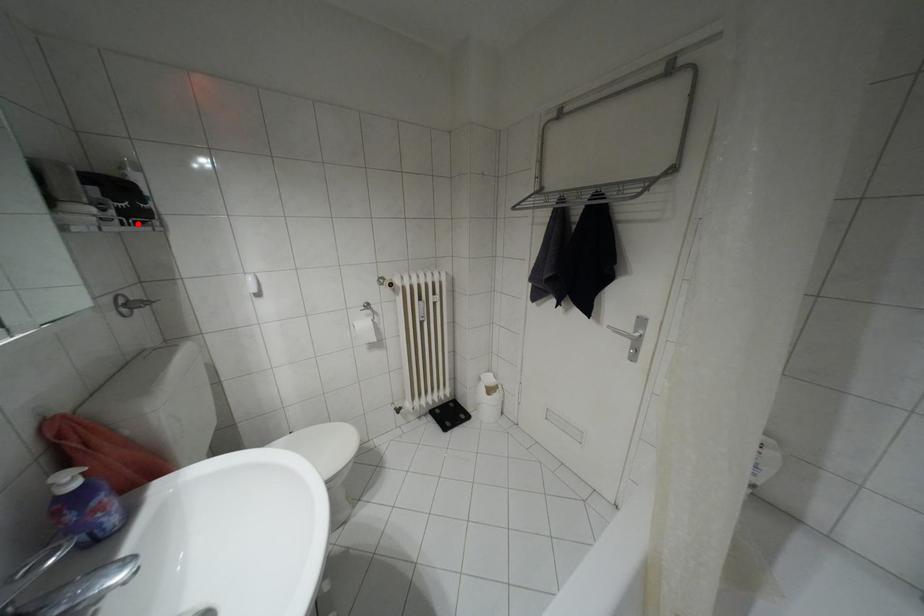
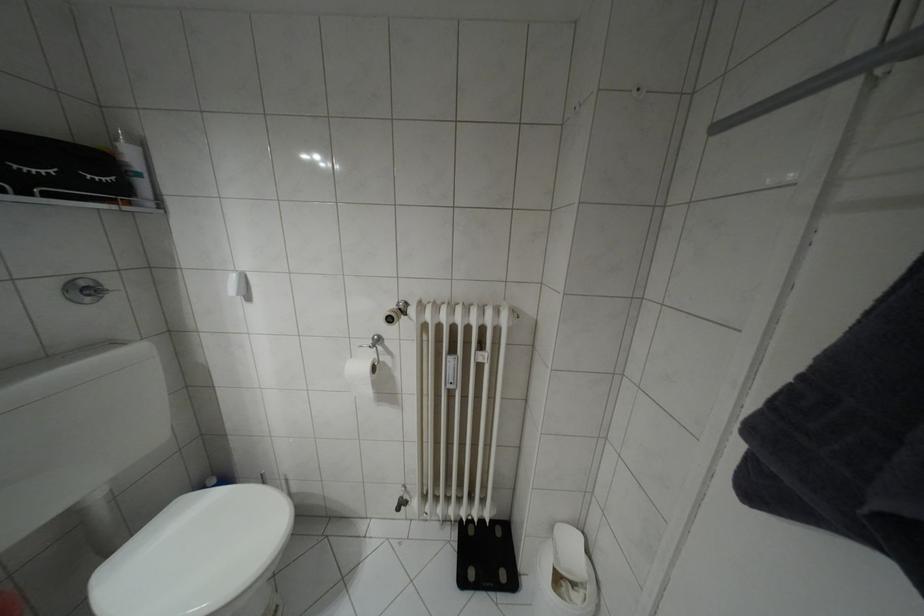
The point at the highlighted location is marked in the first image. Where is the corresponding point in the second image?

(49, 195)